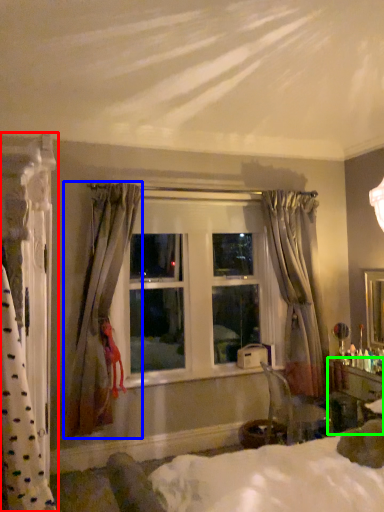
Question: Based on their relative distances, which object is farther from curtain (highlighted by a red box)? Choose from curtain (highlighted by a blue box) and vanity (highlighted by a green box).

Choices:
 (A) curtain
 (B) vanity

Answer: (B)